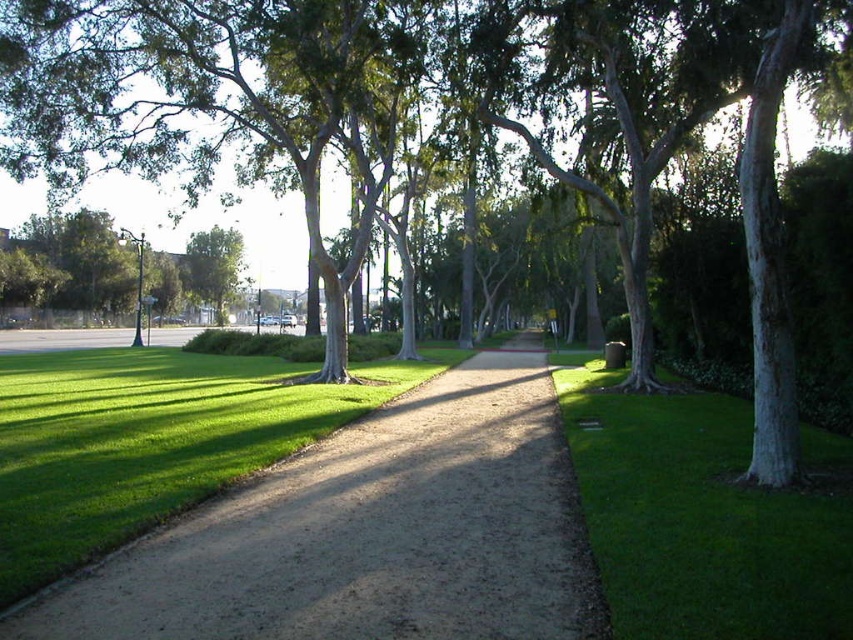
You are a hiker who wants to take a photo of the dirt path at center and the green leafy tree at left. To get the best shot, you need to know their positions relative to each other. Which object is positioned lower in the image?

The dirt path at center is positioned lower than the green leafy tree at left in the image.

You are standing at the starting point of the dirt path in the park. You see two points marked on the path ahead of you. The first point is at coordinates point [824,632] and the second is at point [225,256]. Which point is closer to your current position?

Point [824,632] is closer to the viewer than point [225,256], so the first point is closer to your current position.

You are standing at the point marked by the coordinates point (370, 532) in the park. What is the name of the feature you are currently standing on?

The point (370, 532) marks the dirt path at center, so you are standing on the dirt path at center.